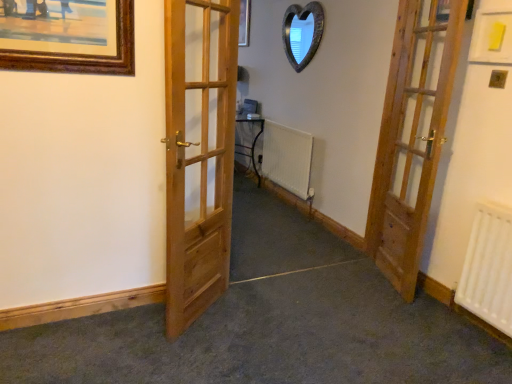
Question: Does natural wood door at center, which is counted as the first door, starting from the left, appear on the left side of white matte radiator at center, which is the second radiator in front-to-back order?

Choices:
 (A) yes
 (B) no

Answer: (A)

Question: Considering the relative positions of natural wood door at center, acting as the second door starting from the right, and white matte radiator at center, acting as the 2th radiator starting from the bottom, in the image provided, is natural wood door at center, acting as the second door starting from the right, in front of white matte radiator at center, acting as the 2th radiator starting from the bottom,?

Choices:
 (A) no
 (B) yes

Answer: (B)

Question: Does natural wood door at center, acting as the second door starting from the right, have a lesser width compared to white matte radiator at center, which appears as the 1th radiator when viewed from the left?

Choices:
 (A) no
 (B) yes

Answer: (A)

Question: Is natural wood door at center, acting as the second door starting from the right, wider than white matte radiator at center, positioned as the 2th radiator in right-to-left order?

Choices:
 (A) yes
 (B) no

Answer: (A)

Question: Is natural wood door at center, which is counted as the first door, starting from the left, not inside white matte radiator at center, which is the first radiator from top to bottom?

Choices:
 (A) yes
 (B) no

Answer: (A)

Question: Based on their sizes in the image, would you say white matte radiator at center, which is the first radiator from top to bottom, is bigger or smaller than wooden heart-shaped mirror at upper center?

Choices:
 (A) small
 (B) big

Answer: (B)

Question: From their relative heights in the image, would you say white matte radiator at center, acting as the 2th radiator starting from the bottom, is taller or shorter than wooden heart-shaped mirror at upper center?

Choices:
 (A) short
 (B) tall

Answer: (B)

Question: Considering the positions of point (302, 178) and point (289, 9), is point (302, 178) closer or farther from the camera than point (289, 9)?

Choices:
 (A) farther
 (B) closer

Answer: (B)

Question: From a real-world perspective, relative to wooden heart-shaped mirror at upper center, is white matte radiator at center, arranged as the 1th radiator when viewed from the back, vertically above or below?

Choices:
 (A) above
 (B) below

Answer: (B)

Question: From a real-world perspective, is wooden door at right, positioned as the second door in left-to-right order, physically located above or below wooden heart-shaped mirror at upper center?

Choices:
 (A) above
 (B) below

Answer: (B)

Question: In terms of width, does wooden door at right, positioned as the second door in left-to-right order, look wider or thinner when compared to wooden heart-shaped mirror at upper center?

Choices:
 (A) wide
 (B) thin

Answer: (A)

Question: From the image's perspective, is wooden door at right, which ranks as the 1th door in right-to-left order, positioned above or below wooden heart-shaped mirror at upper center?

Choices:
 (A) above
 (B) below

Answer: (B)

Question: From their relative heights in the image, would you say wooden door at right, which ranks as the 1th door in right-to-left order, is taller or shorter than wooden heart-shaped mirror at upper center?

Choices:
 (A) short
 (B) tall

Answer: (B)

Question: From the image's perspective, is wooden heart-shaped mirror at upper center positioned above or below wooden door at right, which ranks as the 1th door in right-to-left order?

Choices:
 (A) below
 (B) above

Answer: (B)

Question: Looking at the image, does wooden heart-shaped mirror at upper center seem bigger or smaller compared to wooden door at right, which ranks as the 1th door in right-to-left order?

Choices:
 (A) big
 (B) small

Answer: (B)